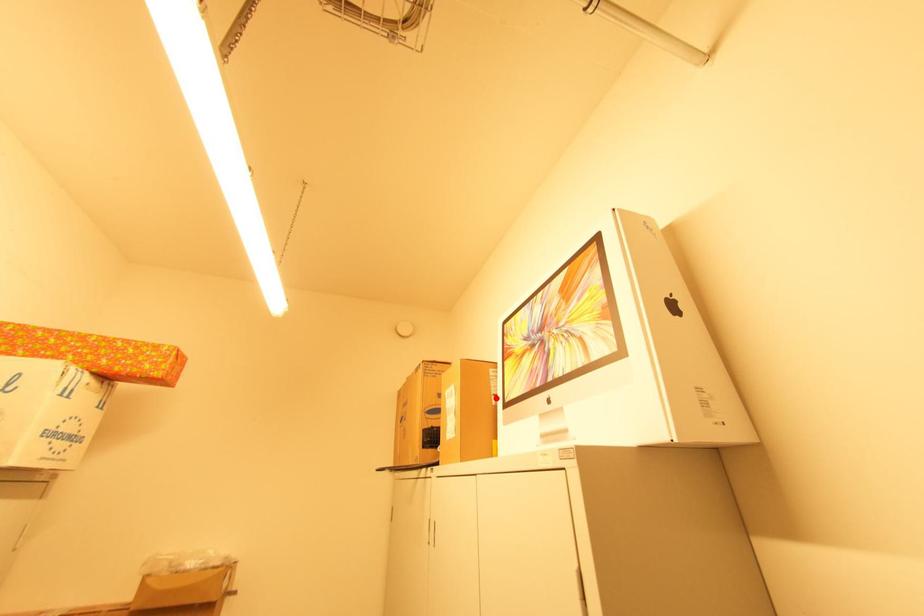
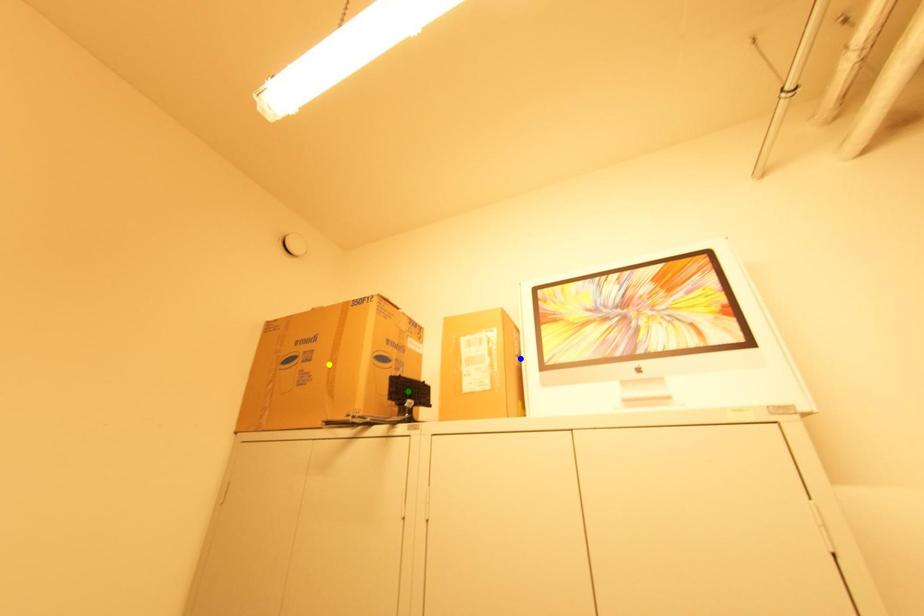
Question: I am providing you with two images of the same scene from different viewpoints. A red point is marked on the first image. You are given multiple points on the second image. Which point in image 2 is actually the same real-world point as the red point in image 1?

Choices:
 (A) yellow point
 (B) blue point
 (C) green point

Answer: (B)